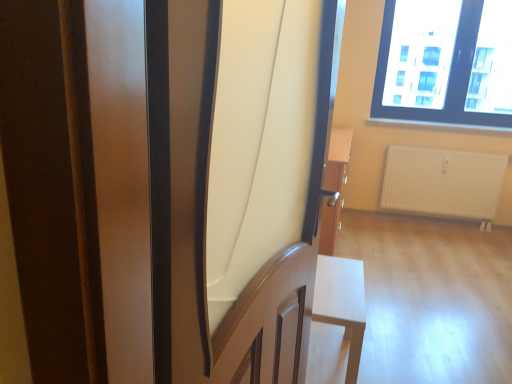
Question: Considering their positions, is matte wood screen door at center located in front of or behind transparent glass window at upper right?

Choices:
 (A) behind
 (B) front

Answer: (B)

Question: Considering the positions of point [173, 292] and point [451, 117], is point [173, 292] closer or farther from the camera than point [451, 117]?

Choices:
 (A) closer
 (B) farther

Answer: (A)

Question: Estimate the real-world distances between objects in this image. Which object is closer to the white matte table at lower right?

Choices:
 (A) matte wood screen door at center
 (B) white matte radiator at lower right
 (C) transparent glass window at upper right

Answer: (A)

Question: Which object is the farthest from the transparent glass window at upper right?

Choices:
 (A) white matte table at lower right
 (B) matte wood screen door at center
 (C) white matte radiator at lower right

Answer: (B)